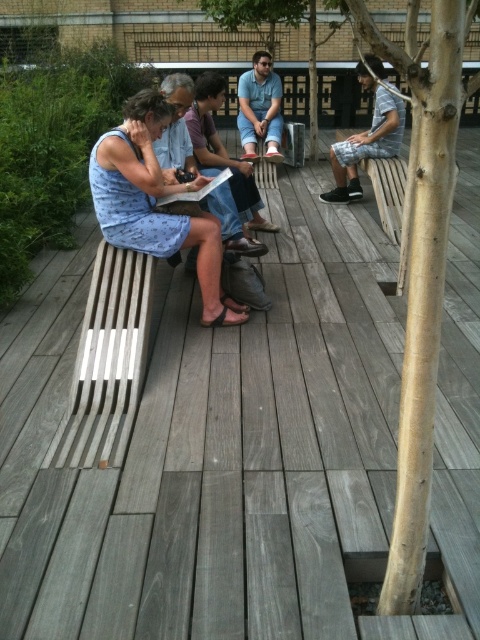
Which of these two, blue printed dress at left or light blue denim shorts at center, stands shorter?

blue printed dress at left is shorter.

Is point (214, 317) behind point (252, 54)?

No, it is not.

At what (x,y) coordinates should I click in order to perform the action: click on blue printed dress at left. Please return your answer as a coordinate pair (x, y). Looking at the image, I should click on pos(153,204).

Measure the distance between point (112,448) and camera.

Point (112,448) is 2.39 meters from camera.

Which is more to the left, gray wood bench at left or light blue denim shorts at center?

From the viewer's perspective, gray wood bench at left appears more on the left side.

Image resolution: width=480 pixels, height=640 pixels. In order to click on gray wood bench at left in this screenshot , I will do `click(107, 362)`.

Who is higher up, denim shorts at center or light blue denim shorts at center?

light blue denim shorts at center is above.

At what (x,y) coordinates should I click in order to perform the action: click on denim shorts at center. Please return your answer as a coordinate pair (x, y). Looking at the image, I should click on coord(179,128).